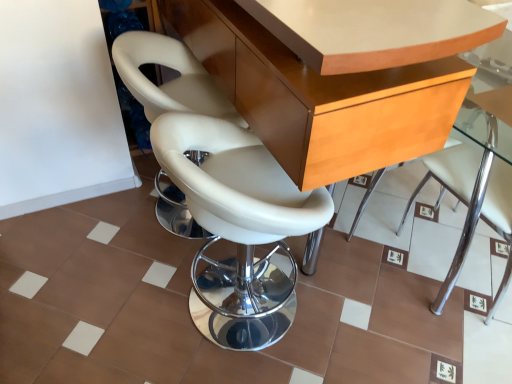
Question: Is light brown wood table at center taller or shorter than white leather chair at center, which ranks as the 1th chair in right-to-left order?

Choices:
 (A) tall
 (B) short

Answer: (A)

Question: Considering the positions of light brown wood table at center and white leather chair at center, which ranks as the 1th chair in right-to-left order, in the image, is light brown wood table at center wider or thinner than white leather chair at center, which ranks as the 1th chair in right-to-left order,?

Choices:
 (A) wide
 (B) thin

Answer: (A)

Question: Based on their relative distances, which object is farther from the white leather chair at center, the 2th chair in the left-to-right sequence?

Choices:
 (A) white leather chair at center, which is counted as the first chair, starting from the left
 (B) light brown wood table at center
 (C) white leather chair at center, which ranks as the 3th chair in left-to-right order

Answer: (C)

Question: Which of these objects is positioned farthest from the light brown wood table at center?

Choices:
 (A) white leather chair at center, which ranks as the 3th chair in right-to-left order
 (B) white leather chair at center, which ranks as the 3th chair in left-to-right order
 (C) white leather chair at center, arranged as the 2th chair when viewed from the right

Answer: (B)